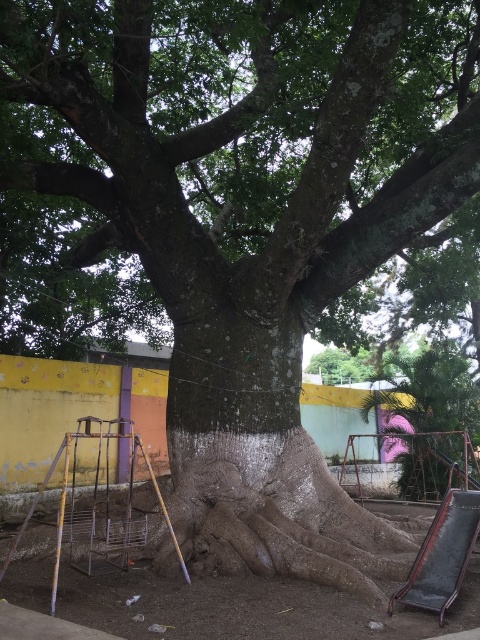
Question: Which of the following is the closest to the observer?

Choices:
 (A) (393, 436)
 (B) (80, 508)

Answer: (B)

Question: Which of the following is the farthest from the observer?

Choices:
 (A) metallic silver ladder at lower left
 (B) green rough textured tree at center

Answer: (B)

Question: Is green rough textured tree at center bigger than metallic silver ladder at lower left?

Choices:
 (A) yes
 (B) no

Answer: (A)

Question: In this image, where is green rough textured tree at center located relative to metallic silver ladder at lower left?

Choices:
 (A) right
 (B) left

Answer: (A)

Question: Is green rough textured tree at center further to camera compared to metallic silver ladder at lower left?

Choices:
 (A) yes
 (B) no

Answer: (A)

Question: Which object appears closest to the camera in this image?

Choices:
 (A) metallic silver ladder at lower left
 (B) green rough textured tree at center

Answer: (A)